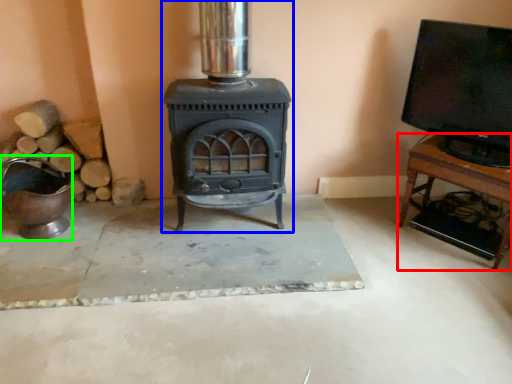
Question: Which is nearer to the furniture (highlighted by a red box)? wood burning stove (highlighted by a blue box) or appliance (highlighted by a green box).

Choices:
 (A) wood burning stove
 (B) appliance

Answer: (A)